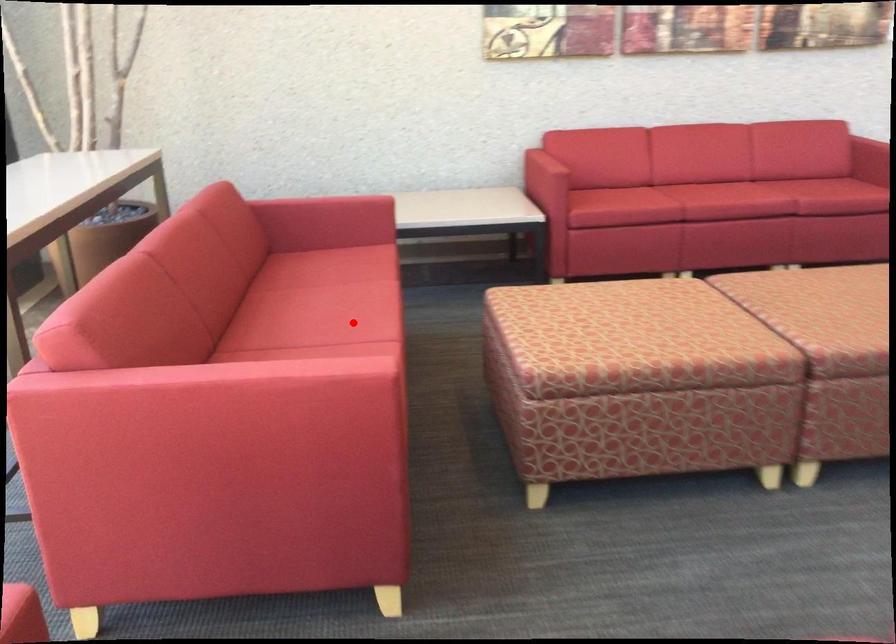
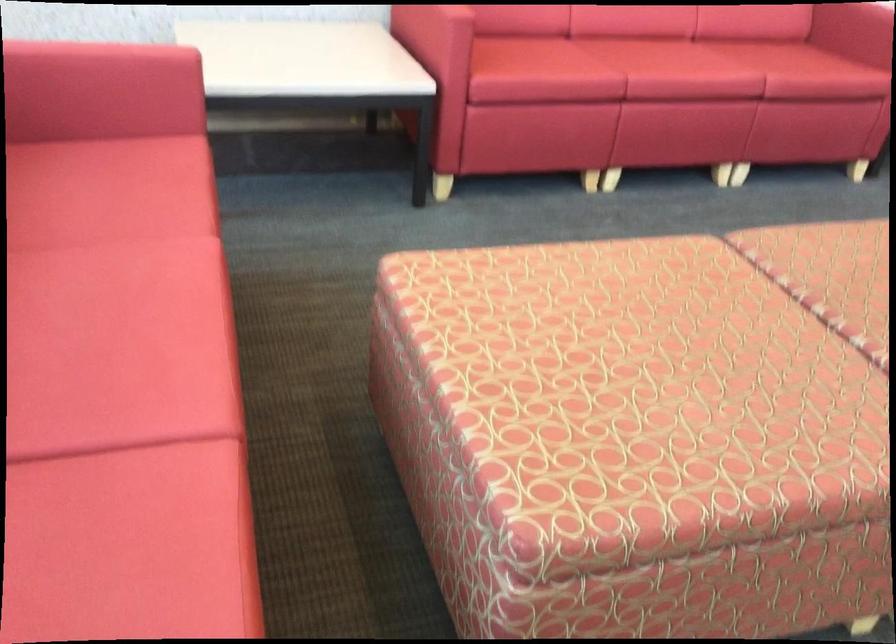
In the second image, find the point that corresponds to the highlighted location in the first image.

(117, 381)